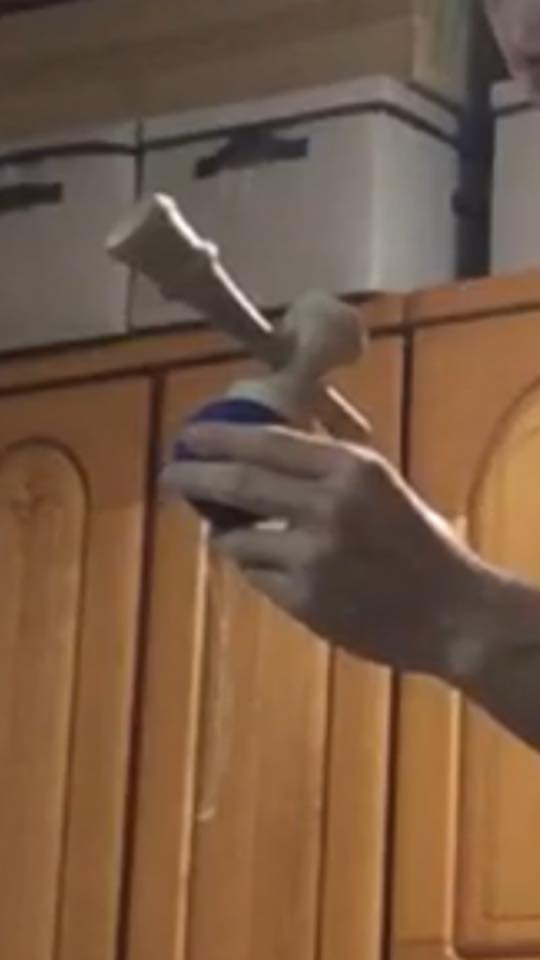
Find the location of a particular element. The height and width of the screenshot is (960, 540). cabinets is located at coordinates (417, 732), (153, 854), (430, 846), (17, 747).